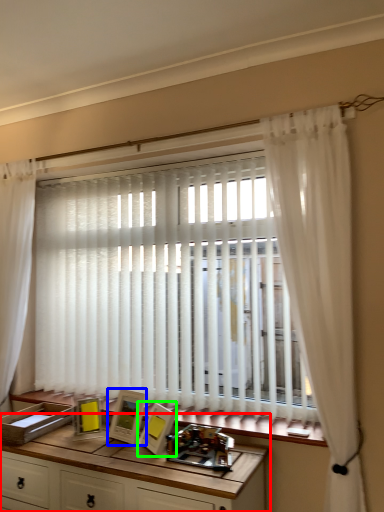
Question: Which is nearer to the table (highlighted by a red box)? picture frame (highlighted by a blue box) or picture frame (highlighted by a green box).

Choices:
 (A) picture frame
 (B) picture frame

Answer: (A)